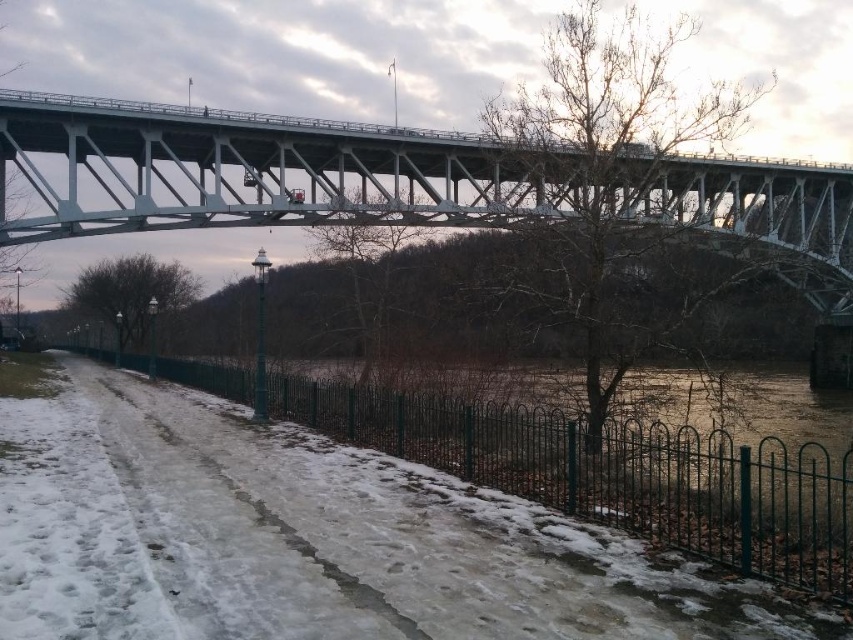
You are standing on the paved pathway near the dark green metal fence and want to reach the point marked as point (309, 538). Is this point located on the snow or on the paved pathway?

The point (309, 538) is on white powdery snow at lower left, so it is located on the snow.

You are a delivery person trying to navigate from the white powdery snow at lower left to the white metallic bridge at upper center. Which direction should you move to reach the bridge?

The white powdery snow at lower left is positioned on the left side of white metallic bridge at upper center, so you should move to the right to reach the bridge.